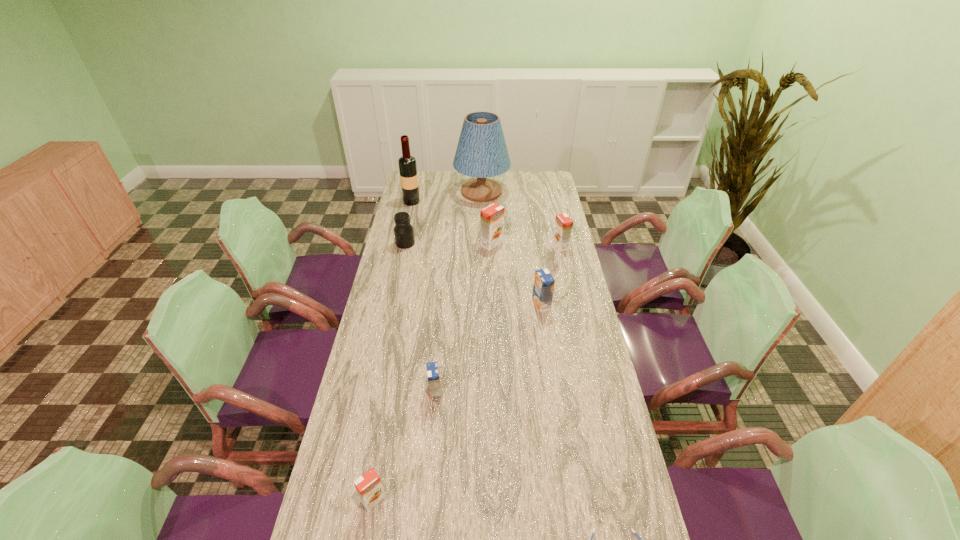
Locate which orange orange juice ranks in proximity to the wine bottle. Please provide its 2D coordinates. Your answer should be formatted as a tuple, i.e. [(x, y)], where the tuple contains the x and y coordinates of a point satisfying the conditions above.

[(491, 217)]

At what (x,y) coordinates should I click in order to perform the action: click on free space in the image that satisfies the following two spatial constraints: 1. on the front side of the wine bottle; 2. on the left side of the second nearest orange juice. Please return your answer as a coordinate pair (x, y). This screenshot has height=540, width=960. Looking at the image, I should click on (370, 391).

Find the location of a particular element. This screenshot has width=960, height=540. vacant position in the image that satisfies the following two spatial constraints: 1. on the back side of the blue lampshade; 2. on the left side of the second nearest orange juice is located at coordinates (453, 192).